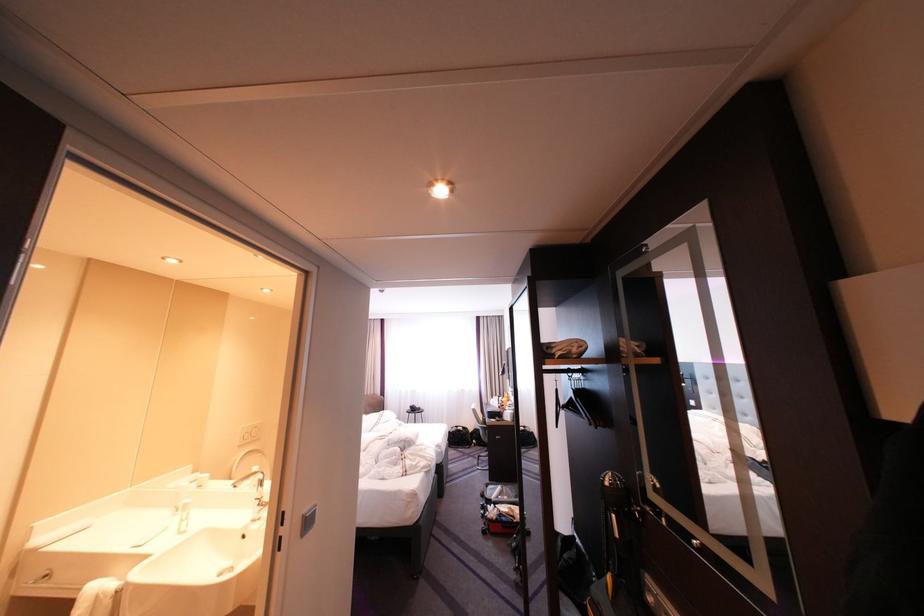
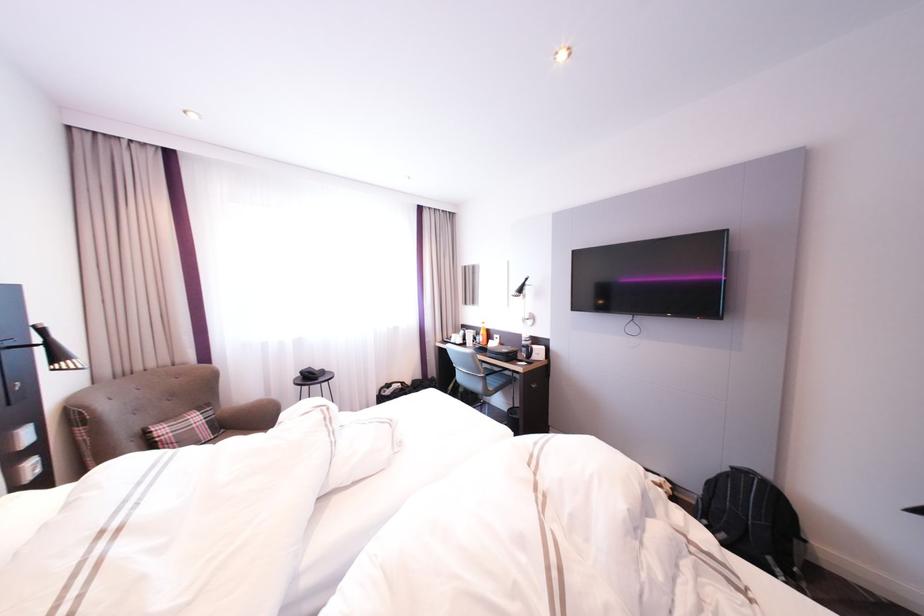
Question: I am providing you with two images of the same scene from different viewpoints. Which of the following objects are not visible in image2?

Choices:
 (A) open red suitcase
 (B) orange toy vehicle
 (C) brown chair sitting surface
 (D) blue chair sitting surface

Answer: (A)